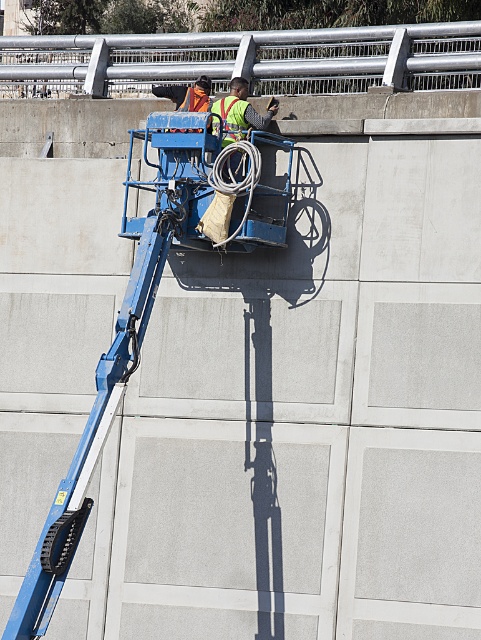
You are standing in front of the large concrete wall and see two points marked on it. The first point is labeled as point (200,88) and the second is point (190,92). Which point is closer to you?

Point (200,88) is closer to the viewer than point (190,92).

Consider the image. You are a safety inspector observing the workers on the blue telescopic lift. You notice two reflective safety vests. Which one is closer to you, the reflective safety vest at upper center or the reflective yellow safety vest at center?

The reflective safety vest at upper center is closer to you because it is further to the viewer than the reflective yellow safety vest at center.

You are a safety inspector observing the workers on the blue telescopic lift. Which worker is wearing the reflective safety vest at upper center and is positioned to the left of the reflective yellow safety vest at center?

The reflective safety vest at upper center is positioned on the left side of the reflective yellow safety vest at center, so the worker wearing the reflective safety vest at upper center is to the left of the reflective yellow safety vest at center.